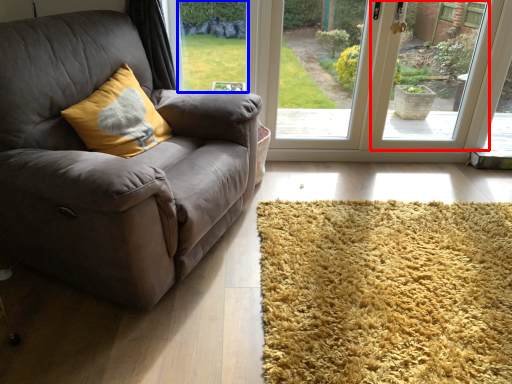
Question: Which object is further to the camera taking this photo, window screen (highlighted by a red box) or window screen (highlighted by a blue box)?

Choices:
 (A) window screen
 (B) window screen

Answer: (B)